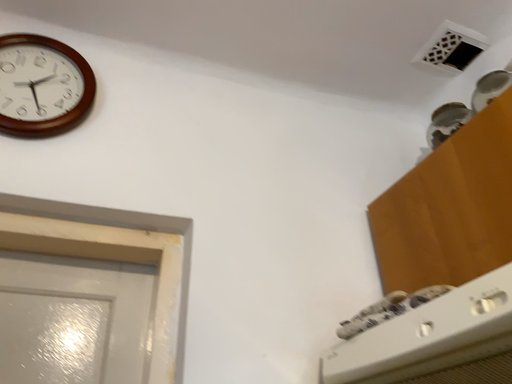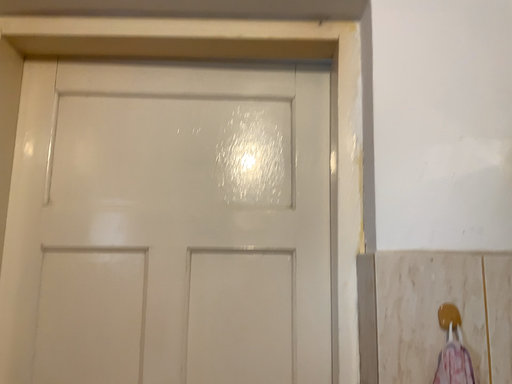
Question: Which way did the camera rotate in the video?

Choices:
 (A) rotated downward
 (B) rotated upward

Answer: (A)